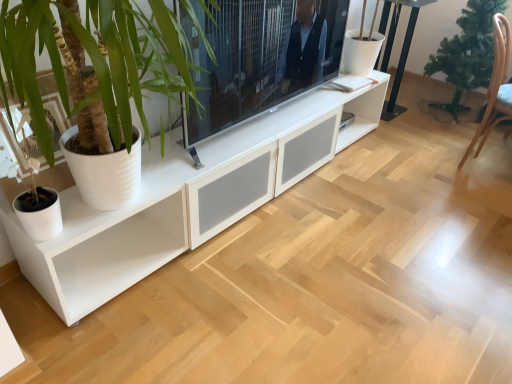
Question: From the image's perspective, is black metal table at upper right below white matte cabinet at center?

Choices:
 (A) yes
 (B) no

Answer: (B)

Question: Is black metal table at upper right positioned beyond the bounds of white matte cabinet at center?

Choices:
 (A) no
 (B) yes

Answer: (B)

Question: Is the position of black metal table at upper right less distant than that of white matte cabinet at center?

Choices:
 (A) no
 (B) yes

Answer: (A)

Question: Is black metal table at upper right wider than white matte cabinet at center?

Choices:
 (A) no
 (B) yes

Answer: (A)

Question: From a real-world perspective, is black metal table at upper right positioned over white matte cabinet at center based on gravity?

Choices:
 (A) no
 (B) yes

Answer: (A)

Question: Considering the relative sizes of black metal table at upper right and white matte cabinet at center in the image provided, is black metal table at upper right shorter than white matte cabinet at center?

Choices:
 (A) yes
 (B) no

Answer: (A)

Question: Can you see white matte cabinet at center touching black metal table at upper right?

Choices:
 (A) no
 (B) yes

Answer: (A)

Question: Considering the relative sizes of white matte cabinet at center and black metal table at upper right in the image provided, is white matte cabinet at center wider than black metal table at upper right?

Choices:
 (A) yes
 (B) no

Answer: (A)

Question: Would you say white matte cabinet at center is a long distance from black metal table at upper right?

Choices:
 (A) no
 (B) yes

Answer: (B)

Question: Is white matte cabinet at center further to the viewer compared to black metal table at upper right?

Choices:
 (A) no
 (B) yes

Answer: (A)

Question: Is white matte cabinet at center closer to the viewer compared to black metal table at upper right?

Choices:
 (A) yes
 (B) no

Answer: (A)

Question: Is white matte cabinet at center completely or partially outside of black metal table at upper right?

Choices:
 (A) yes
 (B) no

Answer: (A)

Question: Does brown wooden armchair at right have a larger size compared to green matte christmas tree at right?

Choices:
 (A) yes
 (B) no

Answer: (B)